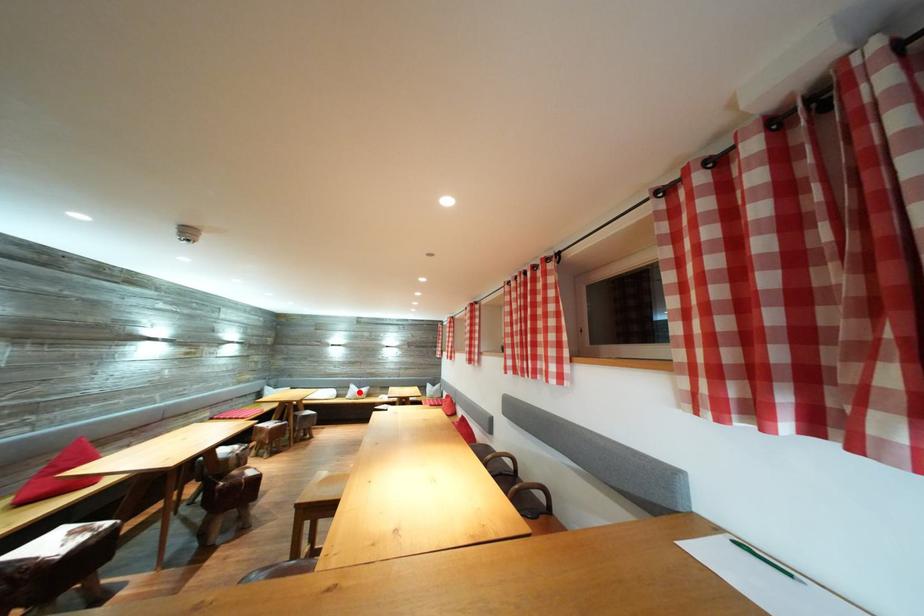
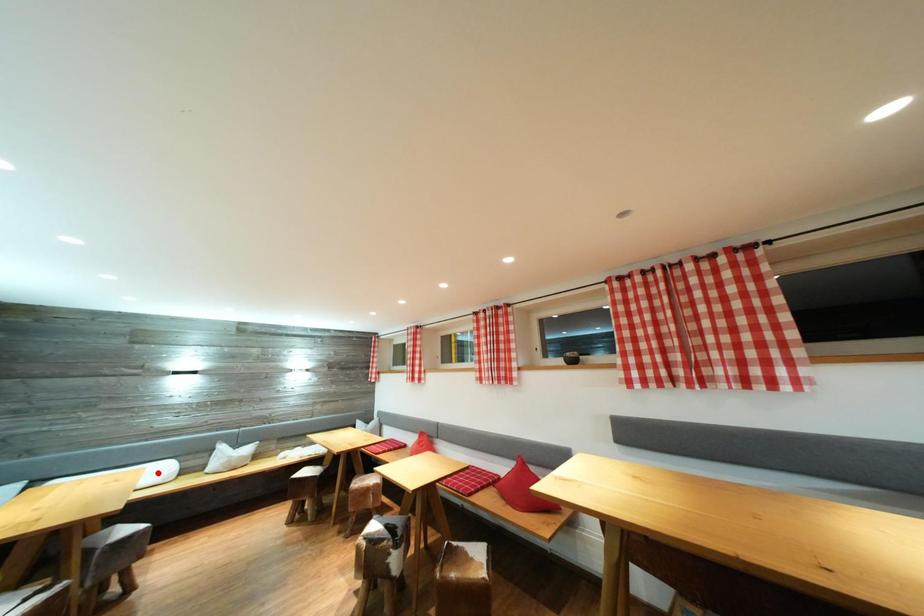
I am providing you with two images of the same scene from different viewpoints. A red point is marked on the first image and another point is marked on the second image. Do the highlighted points in image1 and image2 indicate the same real-world spot?

No